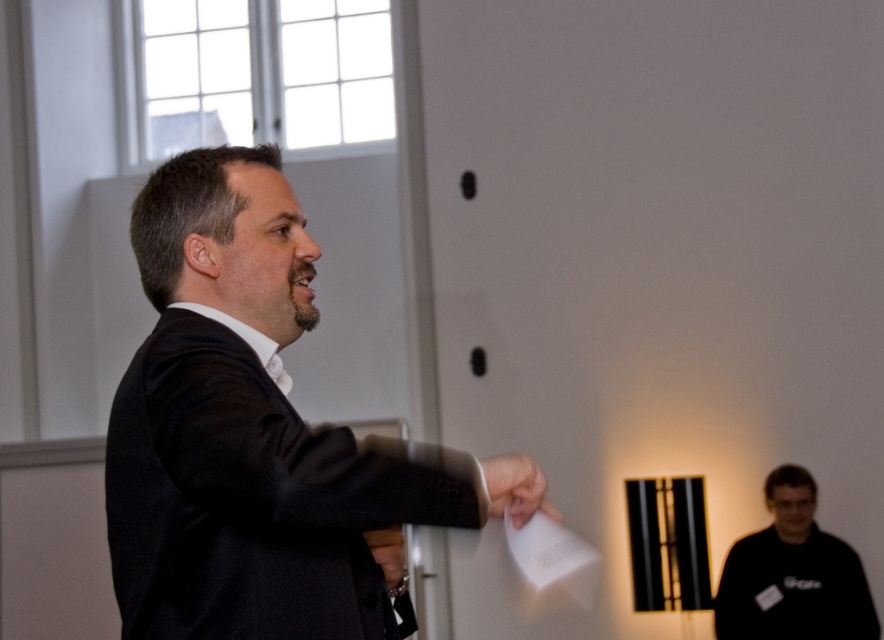
You are an artist in the gallery who needs to hang a new artwork. You see the white paper at center and the matte black hand at center. Which object is shorter in height?

The white paper at center has a lesser height compared to the matte black hand at center, so the white paper at center is shorter.

You are a photographer trying to capture a portrait of the man in the black matte suit at center. The camera you are using has a minimum focusing distance of 1.5 meters. Can you take the photo without moving closer than the camera allows?

The black matte suit at center and the camera are 1.71 meters apart, which is beyond the camera minimum focusing distance of 1.5 meters. Therefore, you can take the photo without moving closer.

You are an artist in the gallery, and you need to place a signature on the white paper at center. Given the position of the matte black hand at center, can you sign it without moving your hand?

The white paper at center is located above the matte black hand at center, so you can sign it by moving your hand upwards since the paper is positioned above the hand.